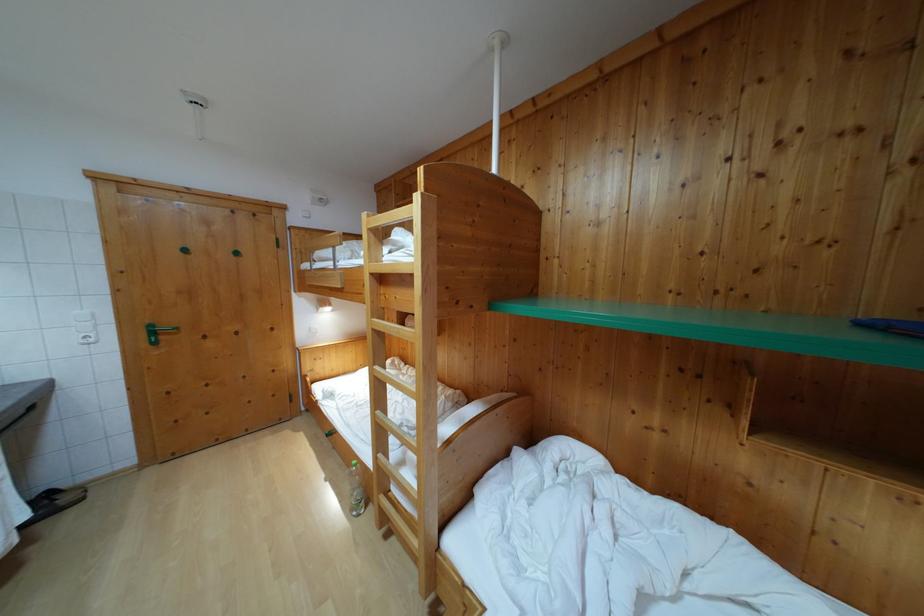
The image size is (924, 616). What are the coordinates of `green door knob` in the screenshot? It's located at (185, 252).